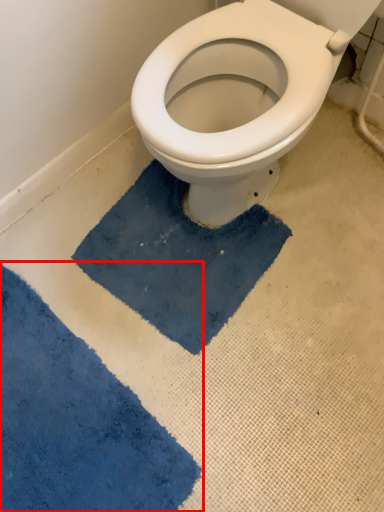
Question: Observing the image, what is the correct spatial positioning of bath mat (annotated by the red box) in reference to bath mat?

Choices:
 (A) right
 (B) left

Answer: (B)